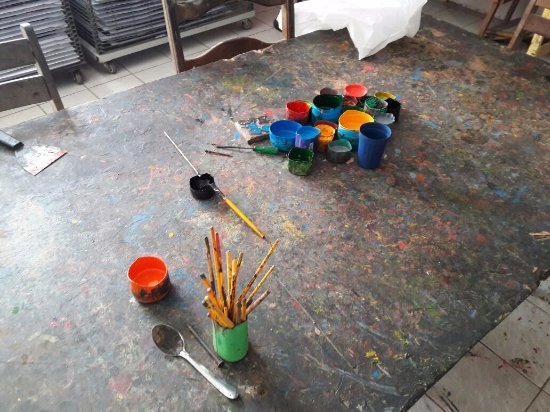
You are a GUI agent. You are given a task and a screenshot of the screen. Output one action in this format:
    pyautogui.click(x=<x>, y=<y>)
    Task: Click on the white papers
    This screenshot has height=412, width=550.
    Given the screenshot: What is the action you would take?
    pyautogui.click(x=47, y=23)